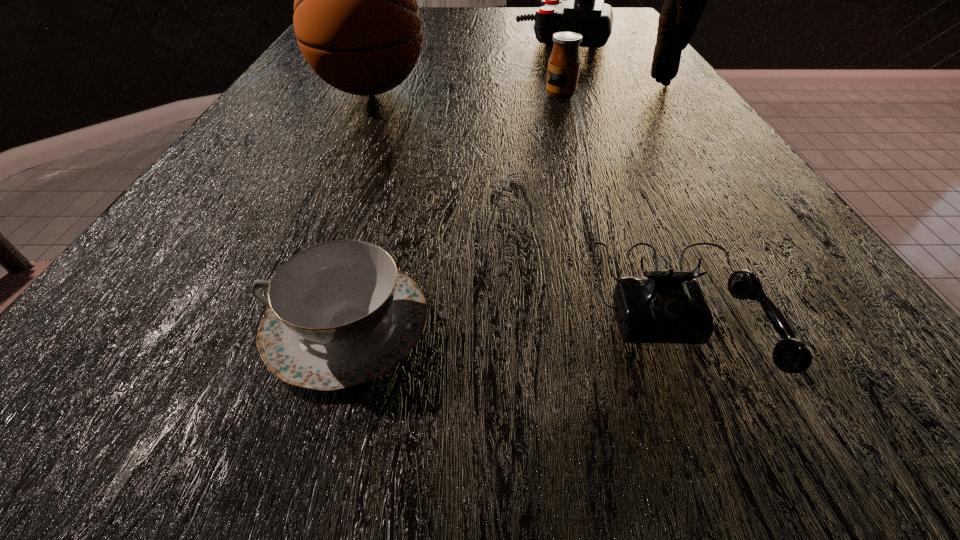
Where is `the tallest object`? Image resolution: width=960 pixels, height=540 pixels. the tallest object is located at coordinates (685, 2).

Where is `the rightmost object`? This screenshot has width=960, height=540. the rightmost object is located at coordinates (685, 2).

Image resolution: width=960 pixels, height=540 pixels. I want to click on basketball, so click(357, 22).

In order to click on the farthest object in this screenshot , I will do `click(584, 12)`.

Where is `the fourth tallest object`? Image resolution: width=960 pixels, height=540 pixels. the fourth tallest object is located at coordinates (564, 62).

Locate an element on the screen. This screenshot has height=540, width=960. telephone is located at coordinates pos(669,306).

This screenshot has width=960, height=540. Identify the location of chinaware. (340, 313).

Find the location of a particular element. This screenshot has width=960, height=540. free region located 0.080m on the front-facing side of the tallest object is located at coordinates pos(676,104).

Find the location of a particular element. The image size is (960, 540). vacant area located 0.060m on the back of the basketball is located at coordinates (384, 60).

Image resolution: width=960 pixels, height=540 pixels. I want to click on vacant space situated 0.200m on the front of the joystick, so (583, 84).